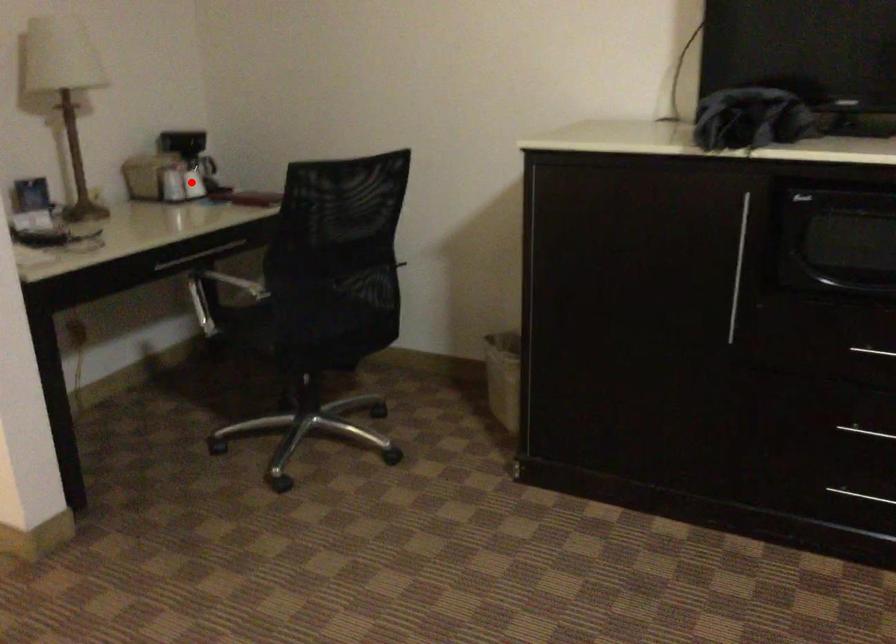
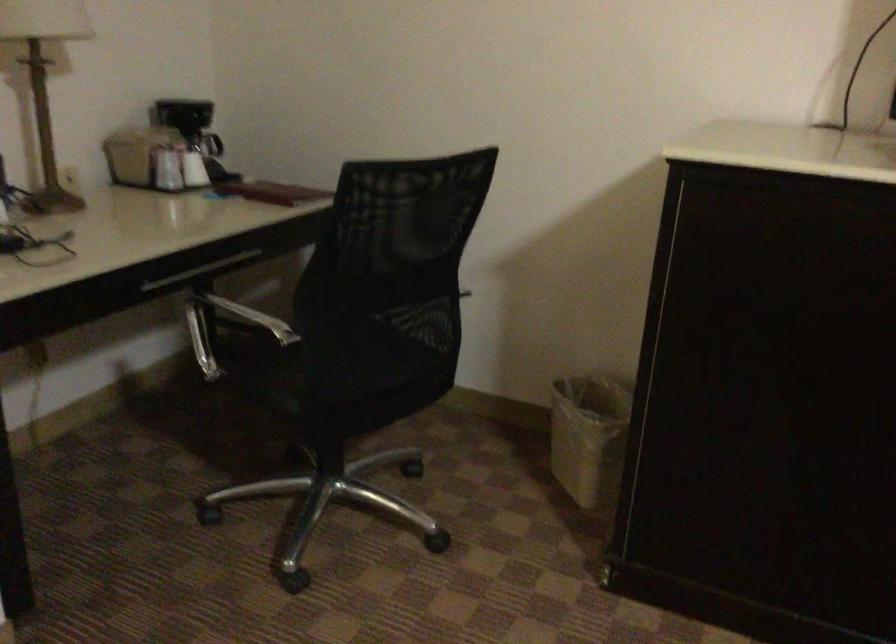
Question: I am providing you with two images of the same scene from different viewpoints. A red point is shown in image1. For the corresponding object point in image2, is it positioned nearer or farther from the camera?

Choices:
 (A) Nearer
 (B) Farther

Answer: (A)